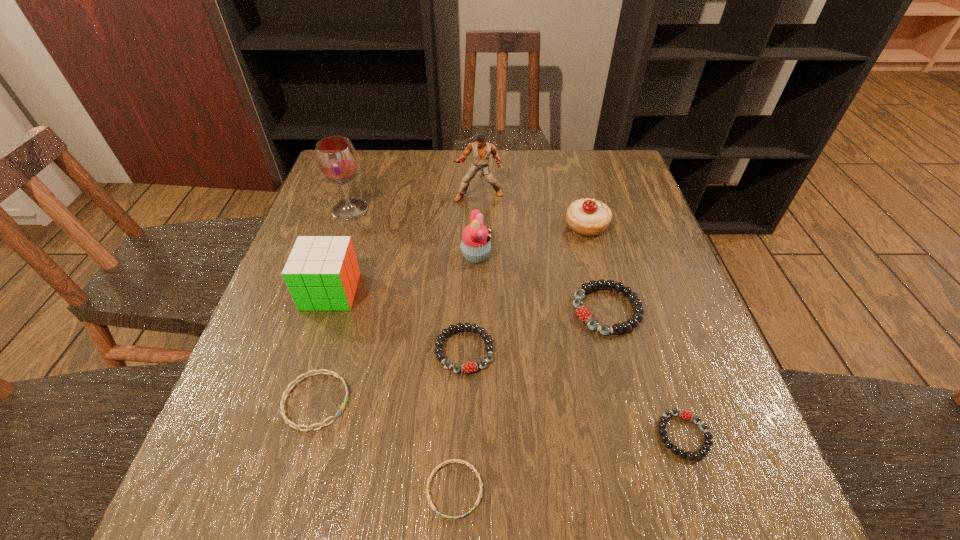
In the image, there is a desktop. Identify the location of vacant space at the far edge. (559, 153).

Locate an element on the screen. The width and height of the screenshot is (960, 540). free space at the near edge of the desktop is located at coordinates (418, 484).

In the image, there is a desktop. Where is `vacant space at the left edge`? The width and height of the screenshot is (960, 540). vacant space at the left edge is located at coordinates (365, 222).

At what (x,y) coordinates should I click in order to perform the action: click on blank area at the right edge. Please return your answer as a coordinate pair (x, y). Image resolution: width=960 pixels, height=540 pixels. Looking at the image, I should click on (647, 254).

Locate an element on the screen. The image size is (960, 540). blank region between the smallest black bracelet and the beige pastry is located at coordinates (635, 330).

Where is `vacant area that lies between the cupcake and the fourth shortest bracelet`? The width and height of the screenshot is (960, 540). vacant area that lies between the cupcake and the fourth shortest bracelet is located at coordinates (470, 303).

The height and width of the screenshot is (540, 960). What are the coordinates of `vacant space that's between the right blue bracelet and the cube` in the screenshot? It's located at (393, 390).

The image size is (960, 540). Find the location of `vacant region between the seventh tallest object and the puncher`. vacant region between the seventh tallest object and the puncher is located at coordinates (471, 273).

Identify the location of vacant area between the puncher and the cube. (404, 244).

The height and width of the screenshot is (540, 960). Find the location of `free area in between the biggest black bracelet and the second smallest black bracelet`. free area in between the biggest black bracelet and the second smallest black bracelet is located at coordinates (536, 330).